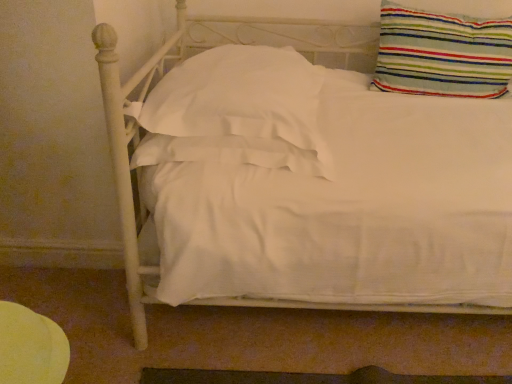
Question: Is white satin pillow at center, arranged as the 2th pillow when viewed from the right, bigger than striped fabric pillow at upper right, the 1th pillow viewed from the right?

Choices:
 (A) yes
 (B) no

Answer: (A)

Question: Is white satin pillow at center, arranged as the 2th pillow when viewed from the right, to the left of striped fabric pillow at upper right, the second pillow viewed from the left, from the viewer's perspective?

Choices:
 (A) yes
 (B) no

Answer: (A)

Question: From the image's perspective, would you say white satin pillow at center, which is the 1th pillow from left to right, is shown under striped fabric pillow at upper right, the 1th pillow viewed from the right?

Choices:
 (A) yes
 (B) no

Answer: (A)

Question: Considering the relative sizes of white satin pillow at center, arranged as the 2th pillow when viewed from the right, and striped fabric pillow at upper right, the second pillow viewed from the left, in the image provided, is white satin pillow at center, arranged as the 2th pillow when viewed from the right, taller than striped fabric pillow at upper right, the second pillow viewed from the left,?

Choices:
 (A) yes
 (B) no

Answer: (B)

Question: Can you confirm if white satin pillow at center, which is the 1th pillow from left to right, is shorter than striped fabric pillow at upper right, the second pillow viewed from the left?

Choices:
 (A) no
 (B) yes

Answer: (B)

Question: Is white satin pillow at center, which is the 1th pillow from left to right, facing towards striped fabric pillow at upper right, the 1th pillow viewed from the right?

Choices:
 (A) yes
 (B) no

Answer: (B)

Question: Can you confirm if striped fabric pillow at upper right, the 1th pillow viewed from the right, is thinner than white satin pillow at center, arranged as the 2th pillow when viewed from the right?

Choices:
 (A) yes
 (B) no

Answer: (A)

Question: Is striped fabric pillow at upper right, the 1th pillow viewed from the right, next to white satin pillow at center, which is the 1th pillow from left to right?

Choices:
 (A) yes
 (B) no

Answer: (B)

Question: Considering the relative sizes of striped fabric pillow at upper right, the 1th pillow viewed from the right, and white satin pillow at center, arranged as the 2th pillow when viewed from the right, in the image provided, is striped fabric pillow at upper right, the 1th pillow viewed from the right, wider than white satin pillow at center, arranged as the 2th pillow when viewed from the right,?

Choices:
 (A) yes
 (B) no

Answer: (B)

Question: From the image's perspective, is striped fabric pillow at upper right, the second pillow viewed from the left, located beneath white satin pillow at center, arranged as the 2th pillow when viewed from the right?

Choices:
 (A) yes
 (B) no

Answer: (B)

Question: From the image's perspective, would you say striped fabric pillow at upper right, the 1th pillow viewed from the right, is positioned over white satin pillow at center, arranged as the 2th pillow when viewed from the right?

Choices:
 (A) no
 (B) yes

Answer: (B)

Question: Does striped fabric pillow at upper right, the 1th pillow viewed from the right, have a larger size compared to white satin pillow at center, which is the 1th pillow from left to right?

Choices:
 (A) no
 (B) yes

Answer: (A)

Question: Looking at the image, does white satin pillow at center, which is the 1th pillow from left to right, seem bigger or smaller compared to striped fabric pillow at upper right, the second pillow viewed from the left?

Choices:
 (A) big
 (B) small

Answer: (A)